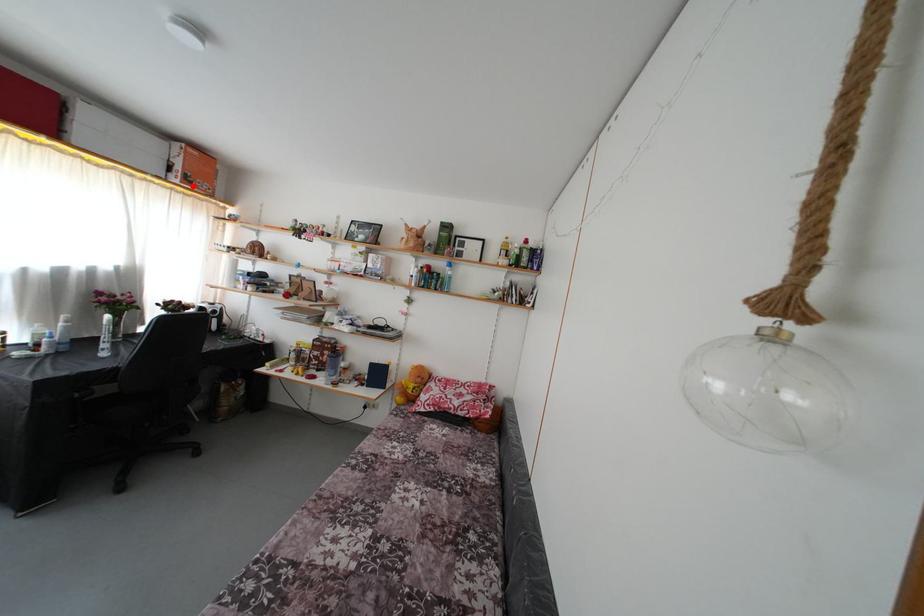
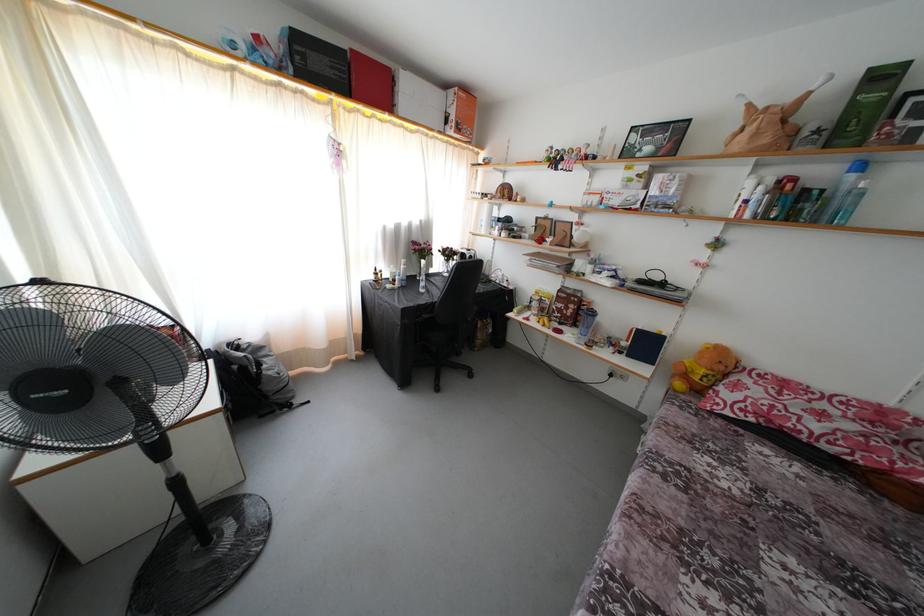
In the second image, find the point that corresponds to the highlighted location in the first image.

(463, 134)